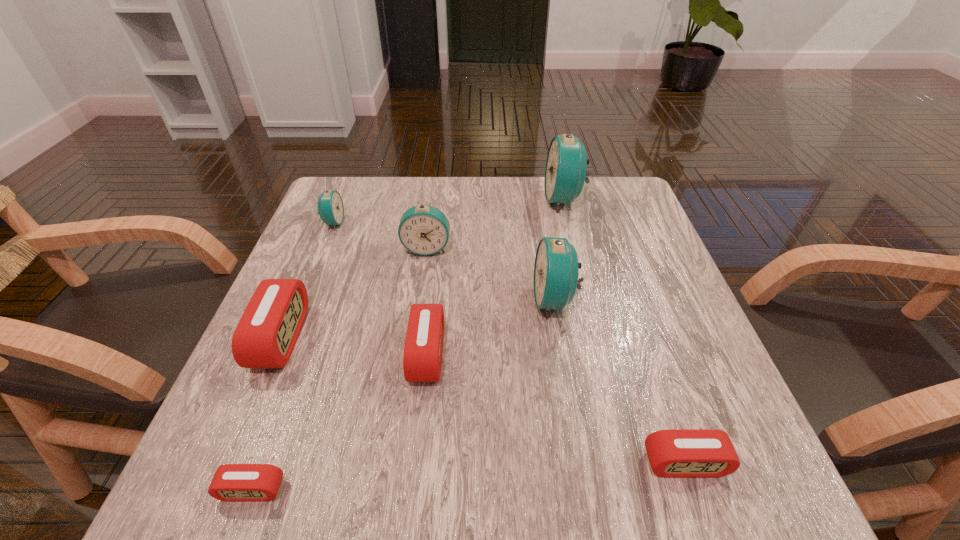
Identify the location of blank space at the left edge. The height and width of the screenshot is (540, 960). (365, 243).

At what (x,y) coordinates should I click in order to perform the action: click on vacant space at the right edge of the desktop. Please return your answer as a coordinate pair (x, y). Looking at the image, I should click on (622, 312).

Find the location of `vacant region at the far left corner of the desktop`. vacant region at the far left corner of the desktop is located at coordinates (347, 194).

I want to click on vacant area at the far right corner, so click(x=630, y=214).

Where is `free spot between the biggest pink alarm clock and the tallest object`? The image size is (960, 540). free spot between the biggest pink alarm clock and the tallest object is located at coordinates (422, 268).

The width and height of the screenshot is (960, 540). What are the coordinates of `vacant area that lies between the biggest pink alarm clock and the shortest alarm clock` in the screenshot? It's located at (267, 413).

This screenshot has height=540, width=960. What are the coordinates of `free space between the sixth nearest alarm clock and the biggest blue alarm clock` in the screenshot? It's located at (495, 224).

This screenshot has width=960, height=540. Identify the location of empty space between the seventh tallest alarm clock and the second pink alarm clock from right to left. (556, 409).

Locate an element on the screen. unoccupied position between the sixth nearest object and the shortest object is located at coordinates tap(339, 369).

The width and height of the screenshot is (960, 540). Find the location of `free space between the second shortest alarm clock and the third shortest alarm clock`. free space between the second shortest alarm clock and the third shortest alarm clock is located at coordinates (556, 409).